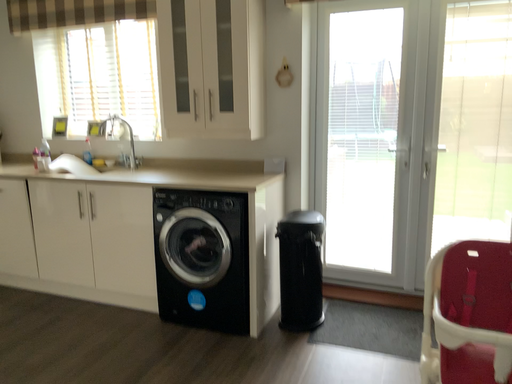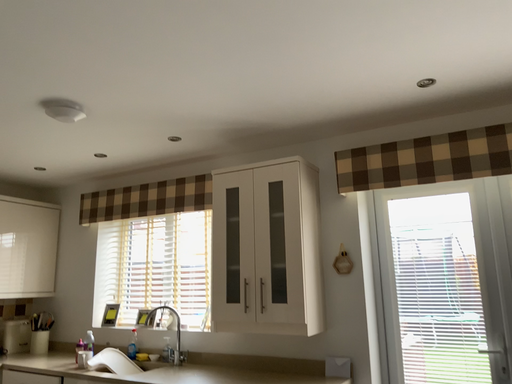
Question: Which way did the camera rotate in the video?

Choices:
 (A) rotated upward
 (B) rotated downward

Answer: (A)